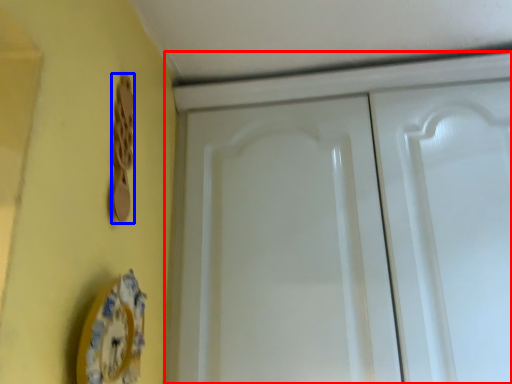
Question: Which of the following is the farthest to the observer, cabinetry (highlighted by a red box) or door handle (highlighted by a blue box)?

Choices:
 (A) cabinetry
 (B) door handle

Answer: (A)